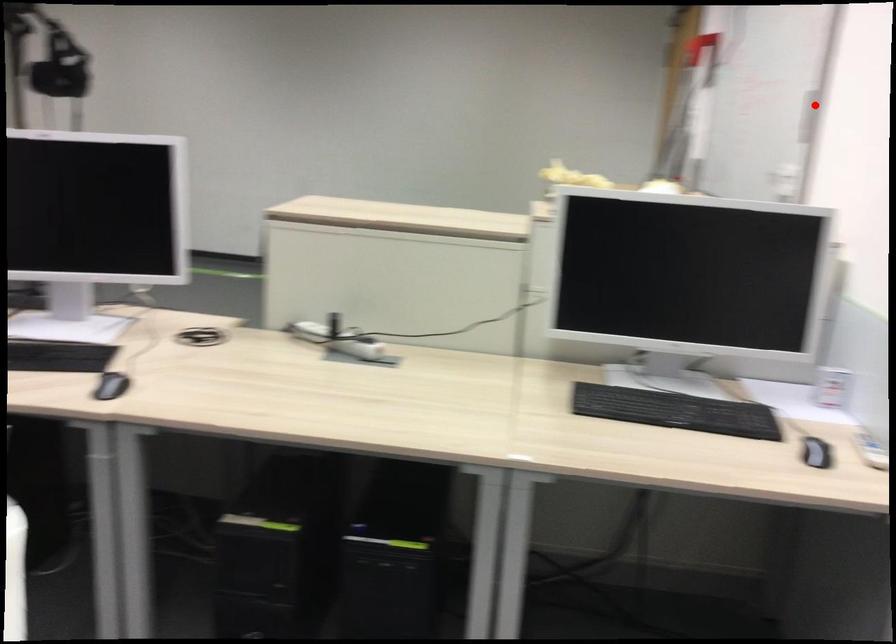
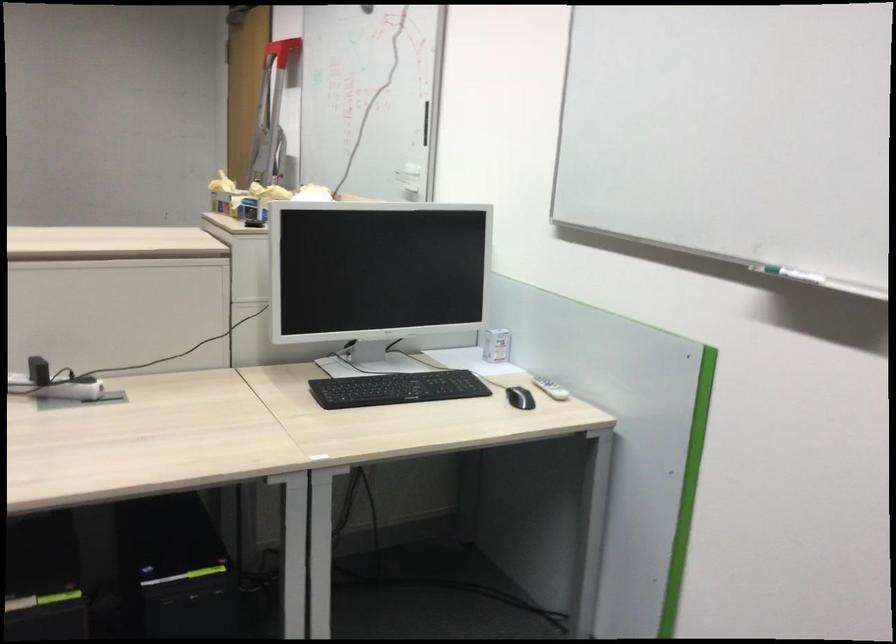
Question: A red point is marked in image1. In image2, is the corresponding 3D point closer to the camera or farther? Reply with the corresponding letter.

Choices:
 (A) The corresponding 3D point is closer.
 (B) The corresponding 3D point is farther.

Answer: (B)